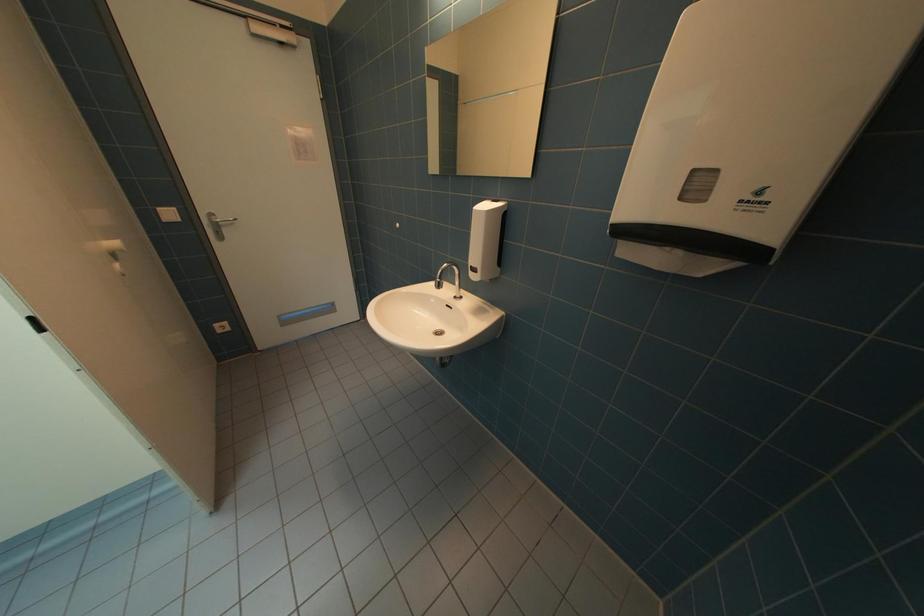
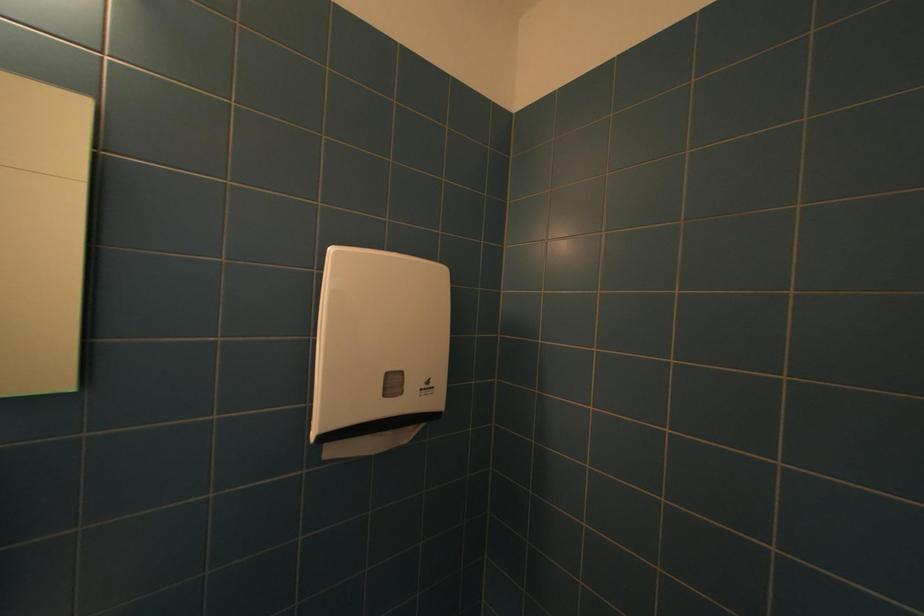
Question: Based on the continuous images, in which direction is the camera rotating? Reply with the corresponding letter.

Choices:
 (A) Left
 (B) Right
 (C) Up
 (D) Down

Answer: (B)